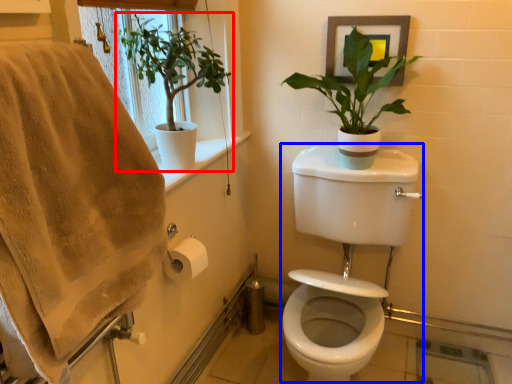
Question: Among these objects, which one is nearest to the camera, houseplant (highlighted by a red box) or sink (highlighted by a blue box)?

Choices:
 (A) houseplant
 (B) sink

Answer: (B)